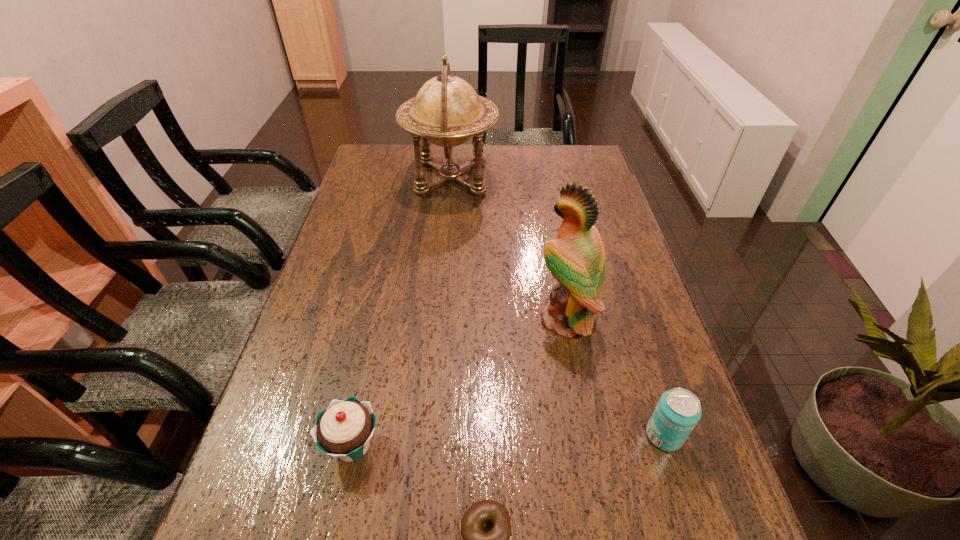
Image resolution: width=960 pixels, height=540 pixels. I want to click on globe, so click(446, 111).

I want to click on the fourth object from left to right, so click(x=576, y=259).

The image size is (960, 540). What are the coordinates of `the fourth nearest object` in the screenshot? It's located at (576, 259).

Find the location of `beer can`. beer can is located at coordinates (678, 411).

This screenshot has height=540, width=960. Find the location of `cupcake`. cupcake is located at coordinates (344, 429).

At what (x,y) coordinates should I click in order to perform the action: click on free space located on the front-facing side of the farthest object. Please return your answer as a coordinate pair (x, y). Looking at the image, I should click on (562, 178).

This screenshot has width=960, height=540. Identify the location of free space located on the front-facing side of the second object from right to left. (466, 319).

Where is `vacant space located 0.150m on the front-facing side of the second object from right to left`? This screenshot has width=960, height=540. vacant space located 0.150m on the front-facing side of the second object from right to left is located at coordinates (474, 319).

This screenshot has height=540, width=960. I want to click on free space located 0.200m on the front-facing side of the second object from right to left, so click(x=453, y=319).

Locate an element on the screen. The width and height of the screenshot is (960, 540). vacant space situated 0.190m on the back of the rightmost object is located at coordinates (635, 342).